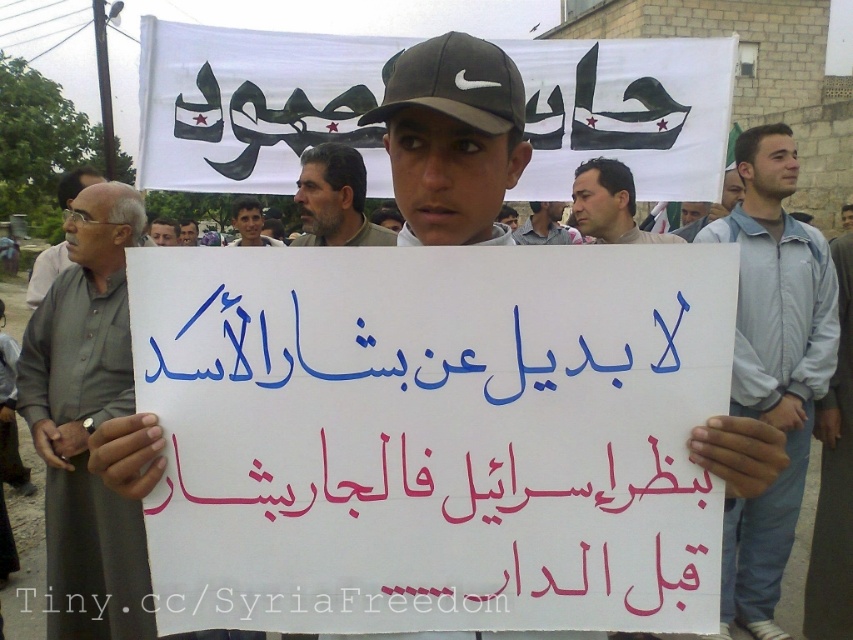
The width and height of the screenshot is (853, 640). In order to click on gray hair at center in this screenshot , I will do `click(335, 198)`.

Is gray fabric shirt at left smaller than light brown skin at center?

Incorrect, gray fabric shirt at left is not smaller in size than light brown skin at center.

Is gray fabric shirt at left thinner than light brown skin at center?

In fact, gray fabric shirt at left might be wider than light brown skin at center.

Locate an element on the screen. gray fabric shirt at left is located at coordinates (86, 422).

Find the location of a particular element. The height and width of the screenshot is (640, 853). gray fabric shirt at left is located at coordinates (86, 422).

Based on the photo, does matte gray cap at center have a lesser width compared to smooth skin face at center?

In fact, matte gray cap at center might be wider than smooth skin face at center.

Is matte gray cap at center bigger than smooth skin face at center?

Indeed, matte gray cap at center has a larger size compared to smooth skin face at center.

Does point (558, 211) lie behind point (247, 227)?

Yes.

Where is `matte gray cap at center`? matte gray cap at center is located at coordinates (543, 225).